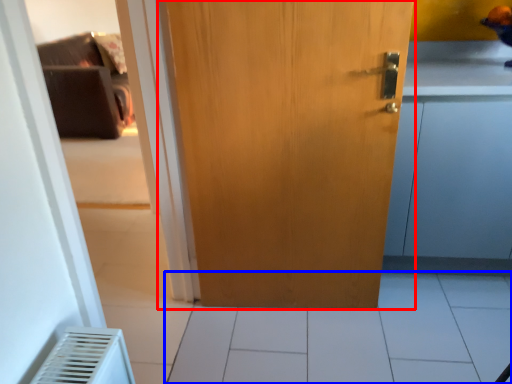
Question: Which object appears closest to the camera in this image, door (highlighted by a red box) or tile (highlighted by a blue box)?

Choices:
 (A) door
 (B) tile

Answer: (A)